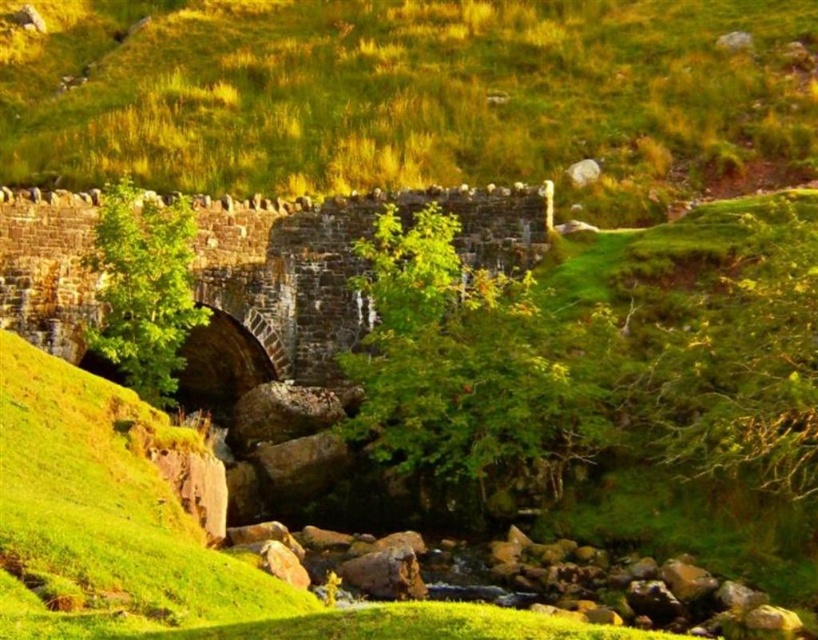
Question: Does green grassy at center appear under brown stone bridge at center?

Choices:
 (A) yes
 (B) no

Answer: (B)

Question: Which point is closer to the camera?

Choices:
 (A) (351, 108)
 (B) (493, 253)

Answer: (B)

Question: Can you confirm if green grassy at center is positioned to the left of brown stone bridge at center?

Choices:
 (A) no
 (B) yes

Answer: (A)

Question: Can you confirm if green grassy at center is positioned above brown stone bridge at center?

Choices:
 (A) yes
 (B) no

Answer: (A)